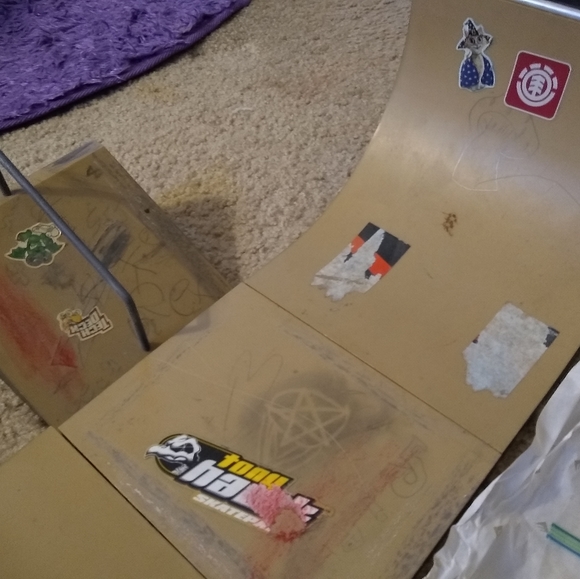
You are a GUI agent. You are given a task and a screenshot of the screen. Output one action in this format:
    pyautogui.click(x=<x>, y=<y>)
    Task: Click on the purple rug
    
    Given the screenshot: What is the action you would take?
    pyautogui.click(x=219, y=21), pyautogui.click(x=152, y=58), pyautogui.click(x=101, y=74), pyautogui.click(x=50, y=86), pyautogui.click(x=32, y=24), pyautogui.click(x=81, y=24), pyautogui.click(x=123, y=23)